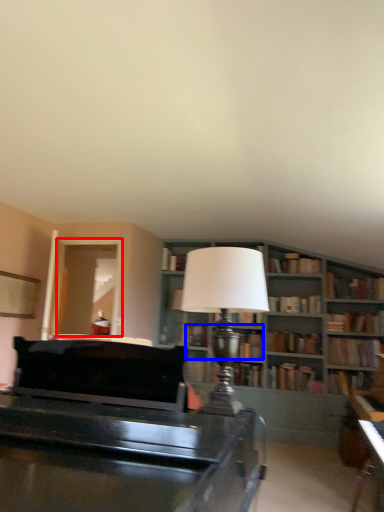
Question: Which object appears farthest to the camera in this image, glass door (highlighted by a red box) or book (highlighted by a blue box)?

Choices:
 (A) glass door
 (B) book

Answer: (B)